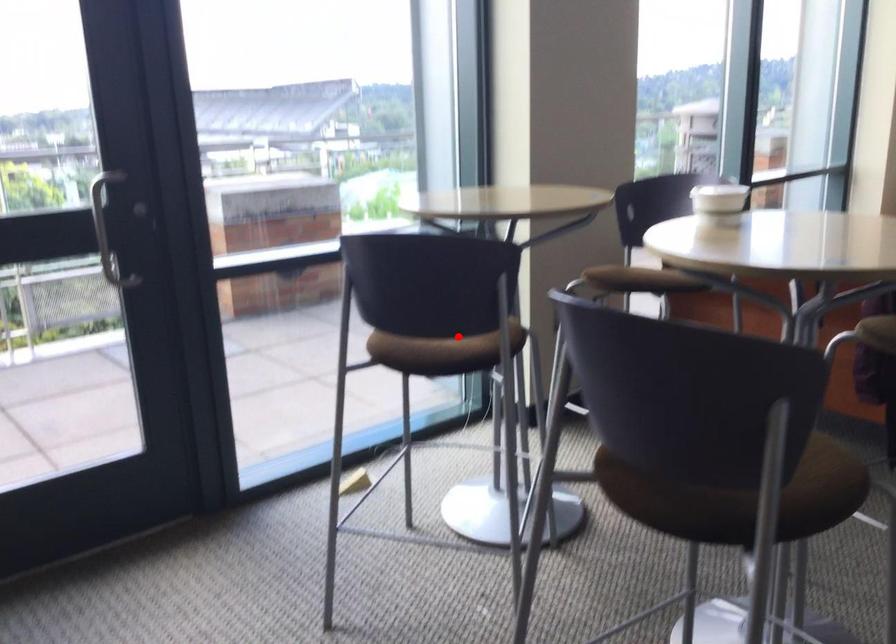
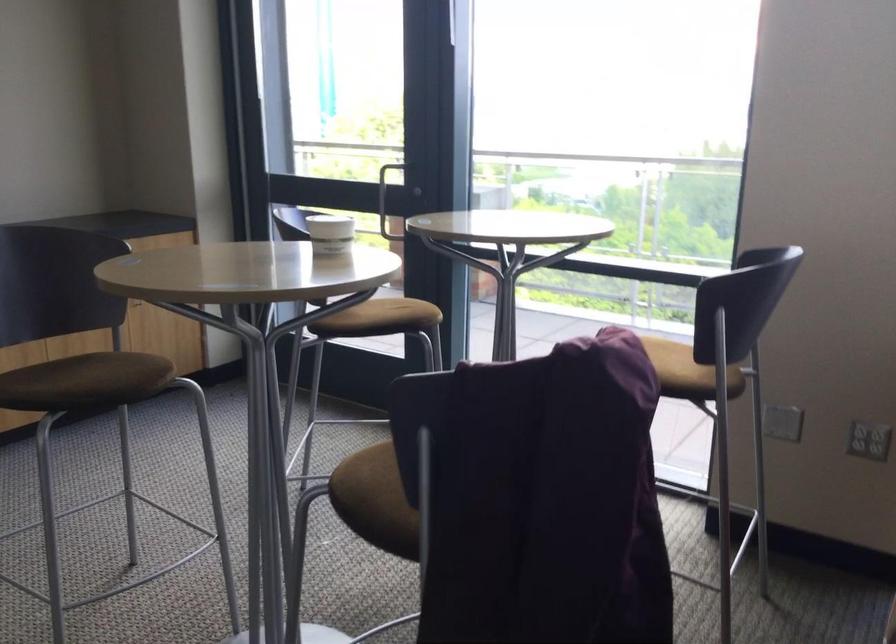
Question: I am providing you with two images of the same scene from different viewpoints. Image1 has a red point marked. In image2, the corresponding 3D location appears at what relative position? Reply with the corresponding letter.

Choices:
 (A) Closer
 (B) Farther

Answer: (B)